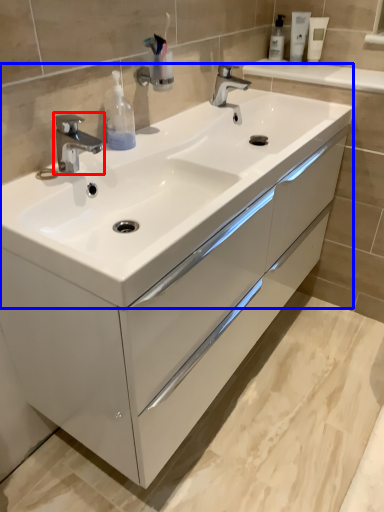
Question: Among these objects, which one is farthest to the camera, tap (highlighted by a red box) or sink (highlighted by a blue box)?

Choices:
 (A) tap
 (B) sink

Answer: (A)